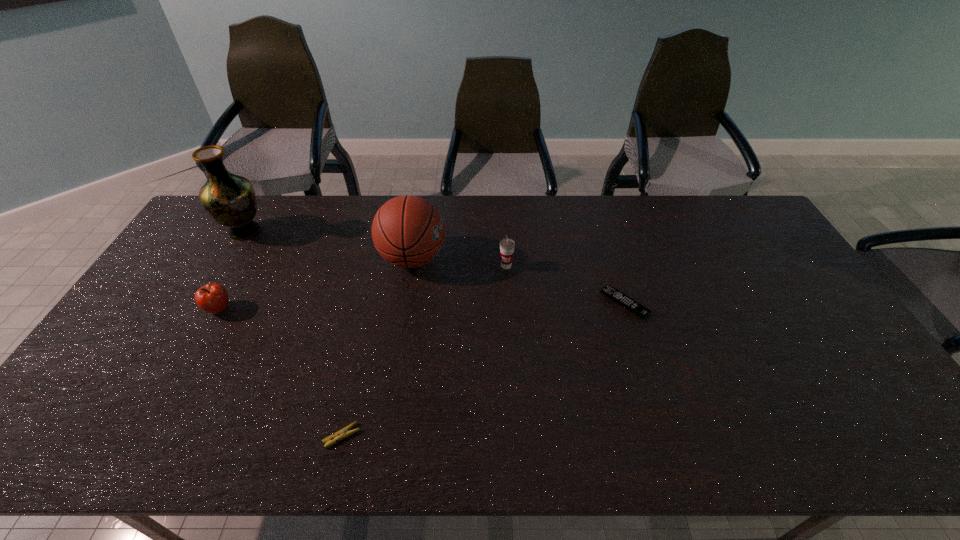
You are a GUI agent. You are given a task and a screenshot of the screen. Output one action in this format:
    pyautogui.click(x=<x>, y=<y>)
    Task: Click on the vase
    
    Given the screenshot: What is the action you would take?
    pyautogui.click(x=230, y=199)

What are the coordinates of `basketball` in the screenshot? It's located at (408, 231).

This screenshot has height=540, width=960. In order to click on the fifth object from left to right in this screenshot , I will do `click(507, 245)`.

You are a GUI agent. You are given a task and a screenshot of the screen. Output one action in this format:
    pyautogui.click(x=<x>, y=<y>)
    Task: Click on the cup
    The image size is (960, 540).
    Given the screenshot: What is the action you would take?
    pyautogui.click(x=507, y=245)

At what (x,y) coordinates should I click in order to perform the action: click on the fourth tallest object. Please return your answer as a coordinate pair (x, y). Looking at the image, I should click on (213, 298).

Find the location of a particular element. The height and width of the screenshot is (540, 960). the rightmost object is located at coordinates (639, 310).

The width and height of the screenshot is (960, 540). In order to click on clothespin in this screenshot , I will do `click(343, 433)`.

Where is `vacant space situated 0.350m on the right of the vase`? This screenshot has width=960, height=540. vacant space situated 0.350m on the right of the vase is located at coordinates (368, 231).

I want to click on free point located 0.230m on the logo side of the second tallest object, so click(517, 259).

Where is `free space located on the side of the third tallest object with the logo`? The height and width of the screenshot is (540, 960). free space located on the side of the third tallest object with the logo is located at coordinates (511, 334).